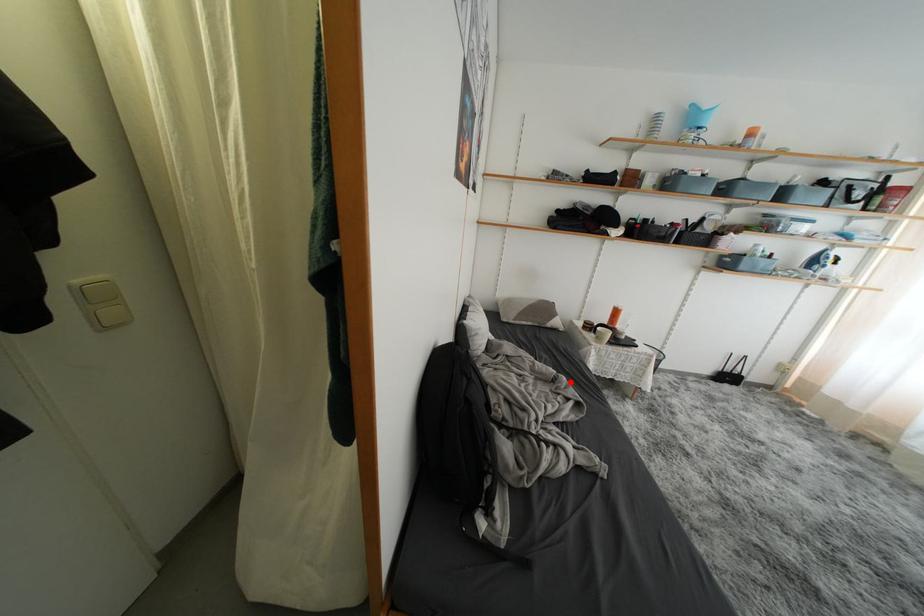
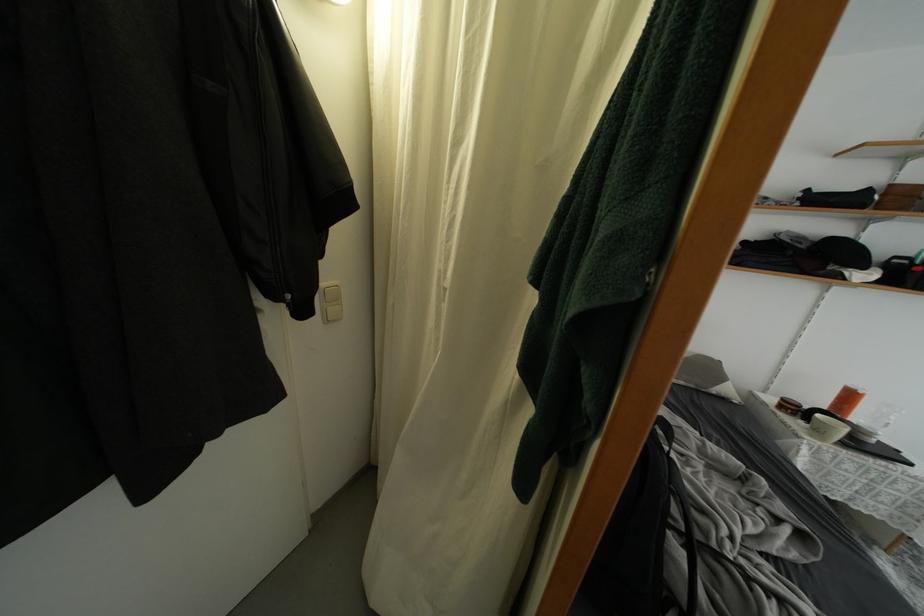
In the second image, find the point that corresponds to the highlighted location in the first image.

(769, 485)